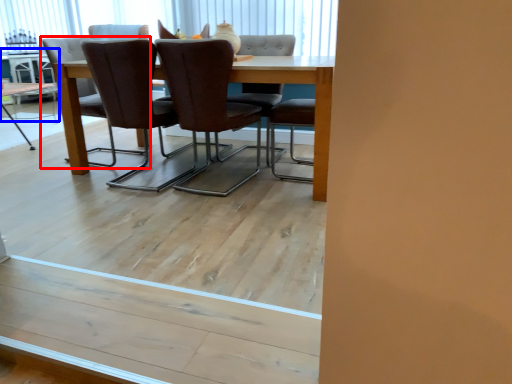
Question: Which object is further to the camera taking this photo, chair (highlighted by a red box) or table (highlighted by a blue box)?

Choices:
 (A) chair
 (B) table

Answer: (B)